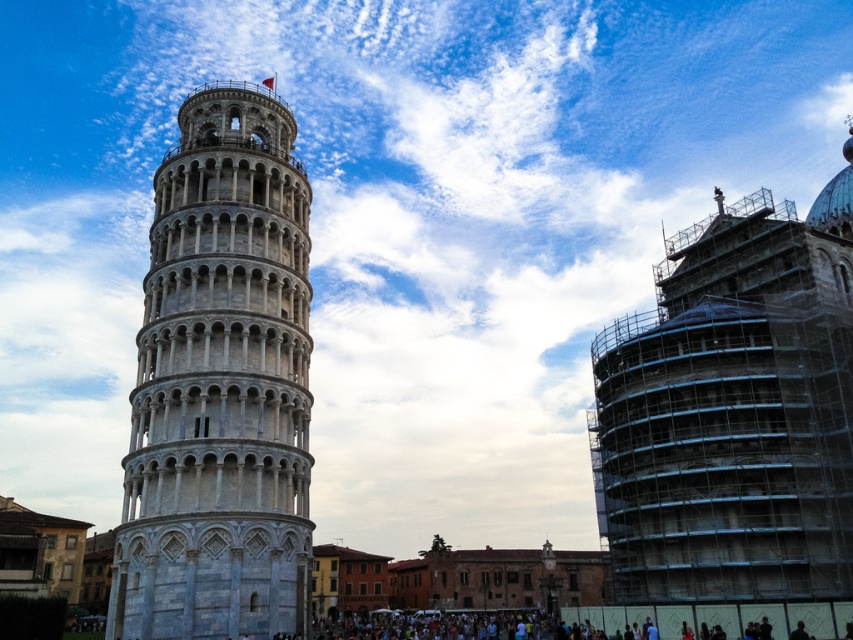
Question: Can you confirm if gray stone tower at center is positioned below dark clothing crowd at lower center?

Choices:
 (A) yes
 (B) no

Answer: (B)

Question: Which of the following is the farthest from the observer?

Choices:
 (A) gray stone tower at center
 (B) dark clothing crowd at lower center

Answer: (B)

Question: Among these points, which one is nearest to the camera?

Choices:
 (A) (302, 400)
 (B) (689, 614)

Answer: (B)

Question: Can you confirm if gray stone tower at center is positioned to the left of dark clothing crowd at lower center?

Choices:
 (A) yes
 (B) no

Answer: (A)

Question: Observing the image, what is the correct spatial positioning of gray stone tower at center in reference to dark clothing crowd at lower center?

Choices:
 (A) left
 (B) right

Answer: (A)